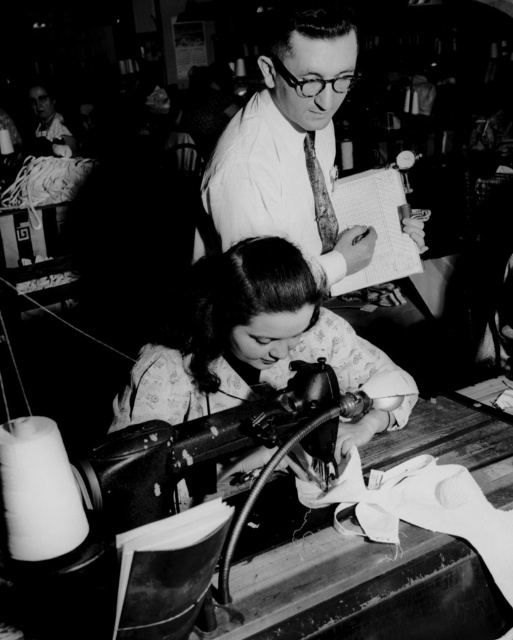
Question: Is matte fabric blouse at center to the left of textured wool tie at upper center from the viewer's perspective?

Choices:
 (A) yes
 (B) no

Answer: (A)

Question: Which point appears farthest from the camera in this image?

Choices:
 (A) (152, 483)
 (B) (42, 92)

Answer: (B)

Question: Does smooth white shirt at upper center appear under textured wool tie at upper center?

Choices:
 (A) no
 (B) yes

Answer: (A)

Question: Which point is closer to the camera?

Choices:
 (A) (312, 387)
 (B) (327, 198)

Answer: (A)

Question: Which object appears closest to the camera in this image?

Choices:
 (A) textured wool tie at upper center
 (B) smooth white shirt at upper center

Answer: (B)

Question: Is smooth white shirt at upper center behind metallic sewing machine at lower center?

Choices:
 (A) no
 (B) yes

Answer: (B)